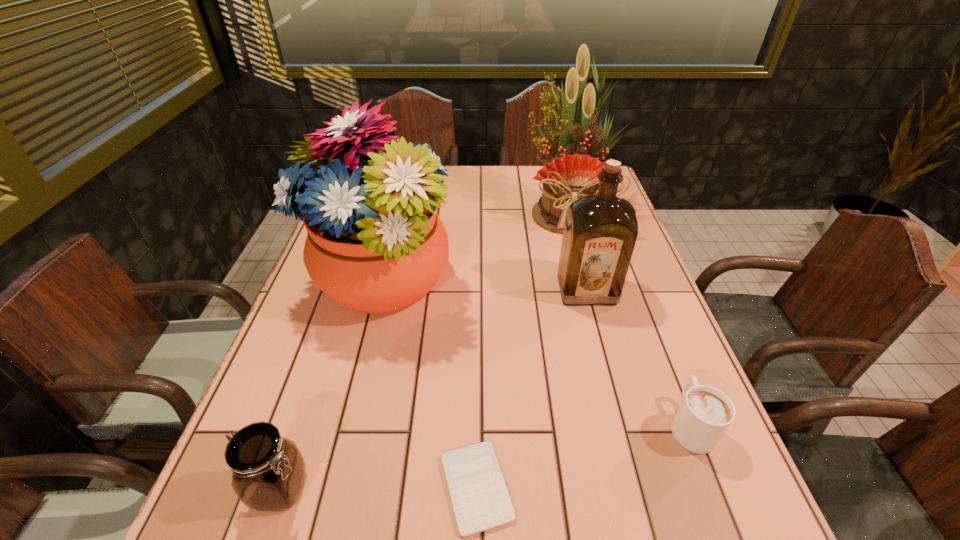
Find the location of a particular element. This screenshot has width=960, height=540. the right flower arrangement is located at coordinates pyautogui.click(x=572, y=173).

Find the location of a particular element. Image resolution: width=960 pixels, height=540 pixels. the left flower arrangement is located at coordinates (375, 244).

You are a GUI agent. You are given a task and a screenshot of the screen. Output one action in this format:
    pyautogui.click(x=<x>, y=<y>)
    Task: Click on the third tallest object
    This screenshot has width=960, height=540.
    Given the screenshot: What is the action you would take?
    pyautogui.click(x=600, y=231)

Find the location of a particular element. the fourth tallest object is located at coordinates (268, 471).

Where is `cappuccino`? cappuccino is located at coordinates (705, 414).

Image resolution: width=960 pixels, height=540 pixels. Identify the location of calculator. (480, 499).

Locate an element on the screen. The height and width of the screenshot is (540, 960). free space located 0.220m in front of the right flower arrangement with the fan visible is located at coordinates (588, 291).

This screenshot has width=960, height=540. Identify the location of blank space located 0.100m on the right of the left flower arrangement. (494, 280).

I want to click on vacant region located on the label of the fourth shortest object, so click(603, 349).

This screenshot has width=960, height=540. I want to click on blank space located 0.190m on the lid of the jar, so click(425, 489).